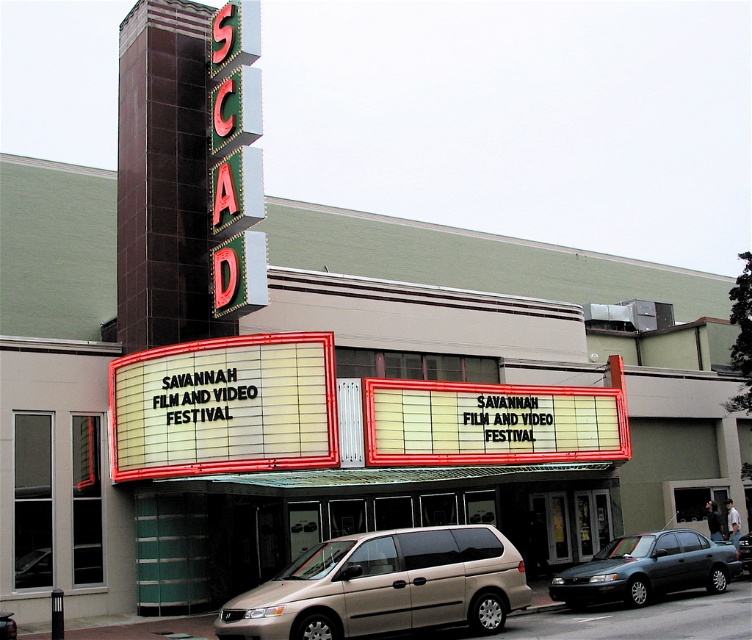
Identify the location of gold metallic minivan at lower center. The width and height of the screenshot is (752, 640). (384, 586).

Is point (350, 611) in front of point (555, 573)?

Yes, it is.

Is point (490, 529) farther from camera compared to point (626, 576)?

No, it is in front of (626, 576).

Locate an element on the screen. This screenshot has width=752, height=640. gold metallic minivan at lower center is located at coordinates (x=384, y=586).

Does white marquee sign at center have a lesser height compared to gold metallic minivan at lower center?

No.

How much distance is there between white marquee sign at center and gold metallic minivan at lower center?

The distance of white marquee sign at center from gold metallic minivan at lower center is 30.65 feet.

Identify the location of white marquee sign at center. pos(337,413).

Who is positioned more to the left, white marquee sign at center or metallic green sedan at center?

Positioned to the left is white marquee sign at center.

Does point (302, 394) lie in front of point (708, 589)?

Yes, it is in front of point (708, 589).

Locate an element on the screen. white marquee sign at center is located at coordinates (337, 413).